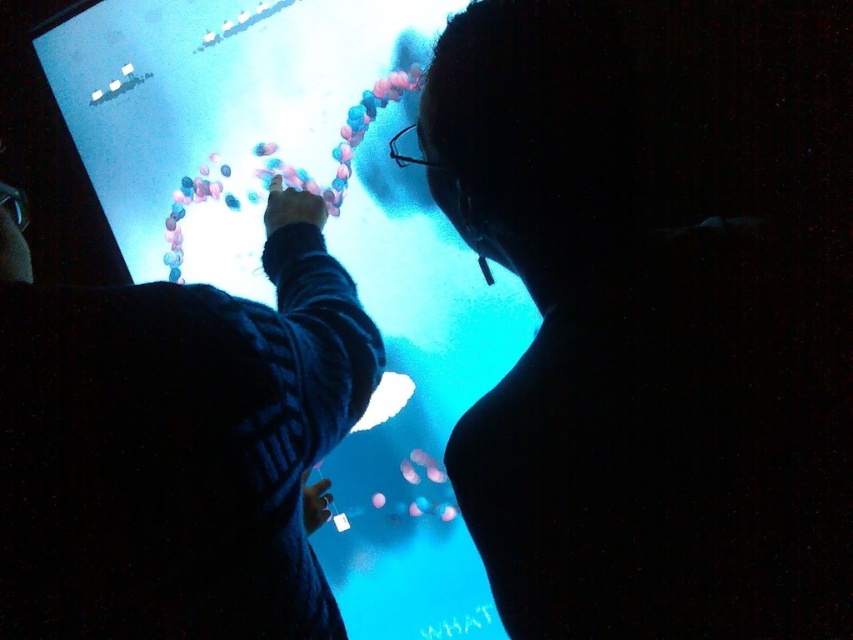
Question: Which object is farther from the camera taking this photo?

Choices:
 (A) silhouette face at upper center
 (B) dark blue sweater at upper center

Answer: (A)

Question: Is silhouette face at upper center wider than dark blue sweater at upper center?

Choices:
 (A) no
 (B) yes

Answer: (B)

Question: Is silhouette face at upper center below dark blue sweater at upper center?

Choices:
 (A) yes
 (B) no

Answer: (B)

Question: Observing the image, what is the correct spatial positioning of silhouette face at upper center in reference to dark blue sweater at upper center?

Choices:
 (A) below
 (B) above

Answer: (B)